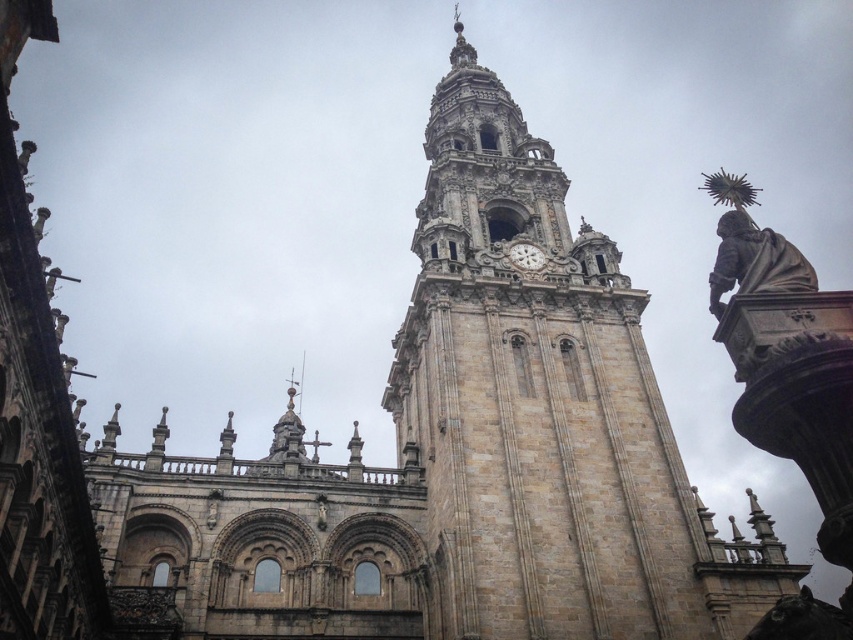
Which of these two, brown stone tower at center or bronze statue at right, stands taller?

brown stone tower at center

Which is more to the left, brown stone tower at center or bronze statue at right?

Positioned to the left is brown stone tower at center.

Between point (492, 266) and point (738, 259), which one is positioned behind?

The point (492, 266) is more distant.

You are a GUI agent. You are given a task and a screenshot of the screen. Output one action in this format:
    pyautogui.click(x=<x>, y=<y>)
    Task: Click on the brown stone tower at center
    
    Given the screenshot: What is the action you would take?
    point(532,401)

Is bronze statue at right thinner than white stone clock at center?

In fact, bronze statue at right might be wider than white stone clock at center.

Is bronze statue at right positioned before white stone clock at center?

Yes.

Is point (752, 252) positioned in front of point (531, 248)?

Yes, it is.

The width and height of the screenshot is (853, 640). I want to click on bronze statue at right, so click(750, 248).

Between point (445, 156) and point (515, 264), which one is positioned behind?

Point (445, 156)

Is point (677, 477) positioned behind point (540, 252)?

No, (677, 477) is in front of (540, 252).

Image resolution: width=853 pixels, height=640 pixels. In order to click on brown stone tower at center in this screenshot , I will do `click(532, 401)`.